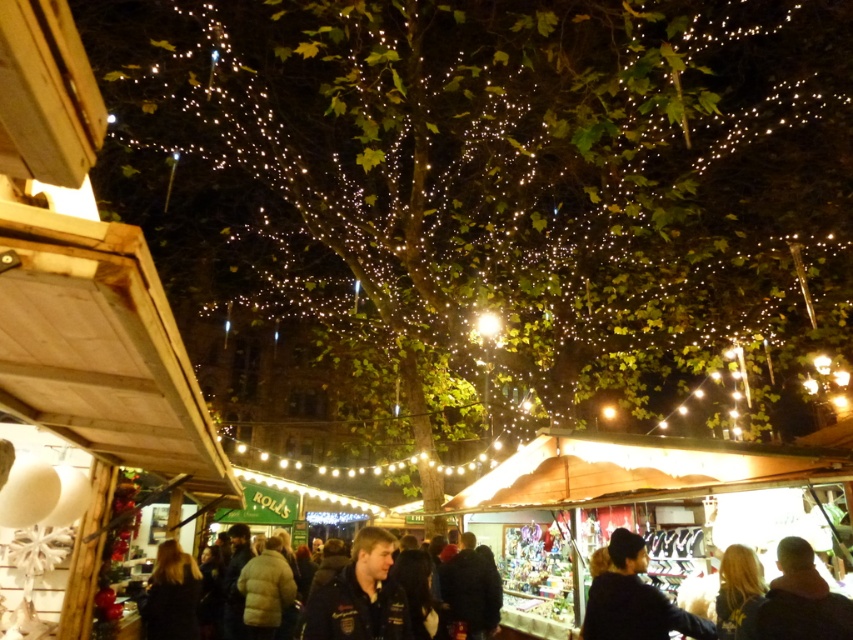
Which is behind, point (323, 636) or point (790, 541)?

Positioned behind is point (790, 541).

Is point (364, 628) more distant than point (802, 627)?

That is True.

Between point (349, 630) and point (763, 628), which one is positioned in front?

Positioned in front is point (763, 628).

Find the location of a particular element. dark blue jacket at center is located at coordinates (360, 595).

Can you confirm if dark blue jacket at center is positioned to the left of dark brown hair at center?

In fact, dark blue jacket at center is to the right of dark brown hair at center.

Can you confirm if dark blue jacket at center is positioned above dark brown hair at center?

Yes.

The image size is (853, 640). Identify the location of dark blue jacket at center. (360, 595).

Image resolution: width=853 pixels, height=640 pixels. Describe the element at coordinates (799, 600) in the screenshot. I see `dark brown leather jacket at lower right` at that location.

Between point (784, 588) and point (172, 541), which one is positioned in front?

Point (784, 588) is more forward.

Is point (770, 627) positioned in front of point (183, 592)?

Yes, it is.

Identify the location of dark brown leather jacket at lower right. (799, 600).